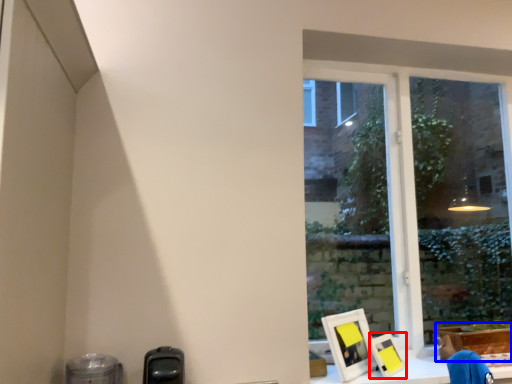
Question: Among these objects, which one is farthest to the camera, picture frame (highlighted by a red box) or cardboard box (highlighted by a blue box)?

Choices:
 (A) picture frame
 (B) cardboard box

Answer: (B)